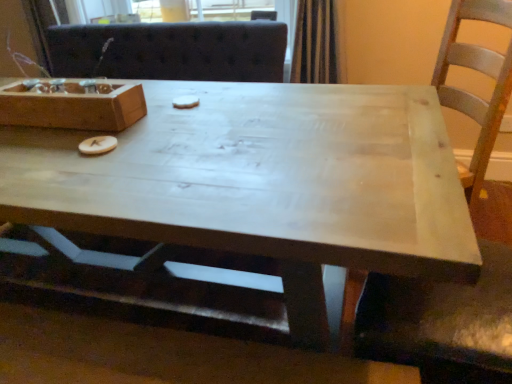
Question: Considering the positions of white matte cookie at center, the first food when ordered from right to left, and wooden letter at center, which appears as the first food when viewed from the left, in the image, is white matte cookie at center, the first food when ordered from right to left, bigger or smaller than wooden letter at center, which appears as the first food when viewed from the left,?

Choices:
 (A) small
 (B) big

Answer: (A)

Question: In the image, is white matte cookie at center, which is the first food from back to front, positioned in front of or behind wooden letter at center, arranged as the first food when ordered from the bottom?

Choices:
 (A) front
 (B) behind

Answer: (B)

Question: Which object is the closest to the light wood coffee table at center?

Choices:
 (A) wooden box at upper left
 (B) white matte cookie at center, which is the 2th food in left-to-right order
 (C) wooden letter at center, arranged as the first food when ordered from the bottom

Answer: (A)

Question: Estimate the real-world distances between objects in this image. Which object is farther from the white matte cookie at center, the first food when ordered from right to left?

Choices:
 (A) wooden box at upper left
 (B) wooden letter at center, which appears as the first food when viewed from the front
 (C) light wood coffee table at center

Answer: (C)